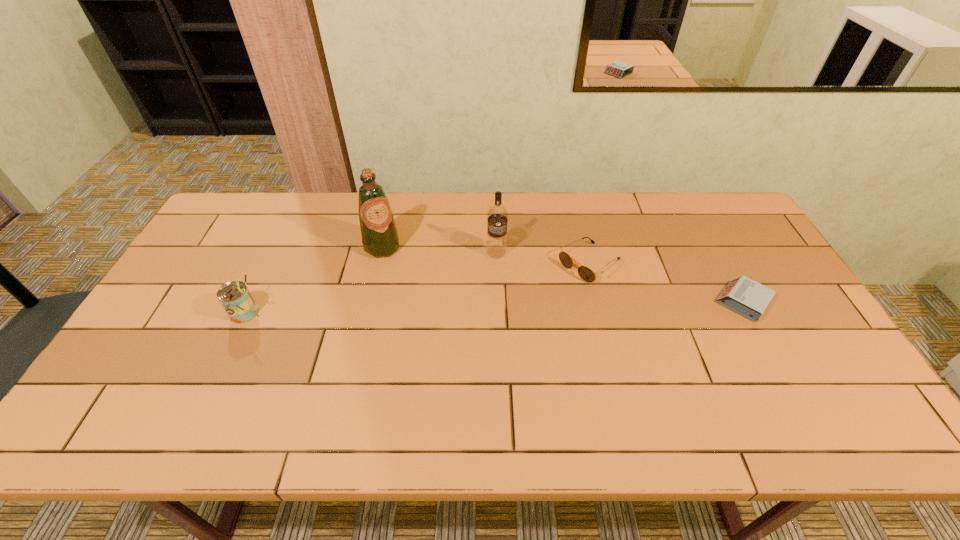
Image resolution: width=960 pixels, height=540 pixels. I want to click on vacant area that lies between the third tallest object and the fourth object from right to left, so click(x=314, y=280).

The image size is (960, 540). Find the location of `blank region between the olive oil and the third object from right to left`. blank region between the olive oil and the third object from right to left is located at coordinates (440, 249).

You are a GUI agent. You are given a task and a screenshot of the screen. Output one action in this format:
    pyautogui.click(x=<x>, y=<y>)
    Task: Click on the vacant point located between the alarm clock and the third shortest object
    The image size is (960, 540).
    Given the screenshot: What is the action you would take?
    pyautogui.click(x=493, y=307)

This screenshot has height=540, width=960. Identify the location of unoccupied position between the tallest object and the second tallest object. (440, 249).

Where is `free space between the leftmost object and the shortest object`? The height and width of the screenshot is (540, 960). free space between the leftmost object and the shortest object is located at coordinates (493, 307).

Identify the location of vacant area that lies between the second object from right to left and the third object from left to right. The height and width of the screenshot is (540, 960). (542, 258).

Where is `free space between the second object from right to left and the can`? free space between the second object from right to left and the can is located at coordinates (417, 288).

Locate an element on the screen. This screenshot has height=540, width=960. vacant space in between the fourth shortest object and the shortest object is located at coordinates [619, 276].

Locate which object ranks third in proximity to the olive oil. Please provide its 2D coordinates. Your answer should be formatted as a tuple, i.e. [(x, y)], where the tuple contains the x and y coordinates of a point satisfying the conditions above.

[(585, 273)]

Find the location of a particular element. This screenshot has width=960, height=540. object identified as the fourth closest to the fourth object from left to right is located at coordinates (236, 299).